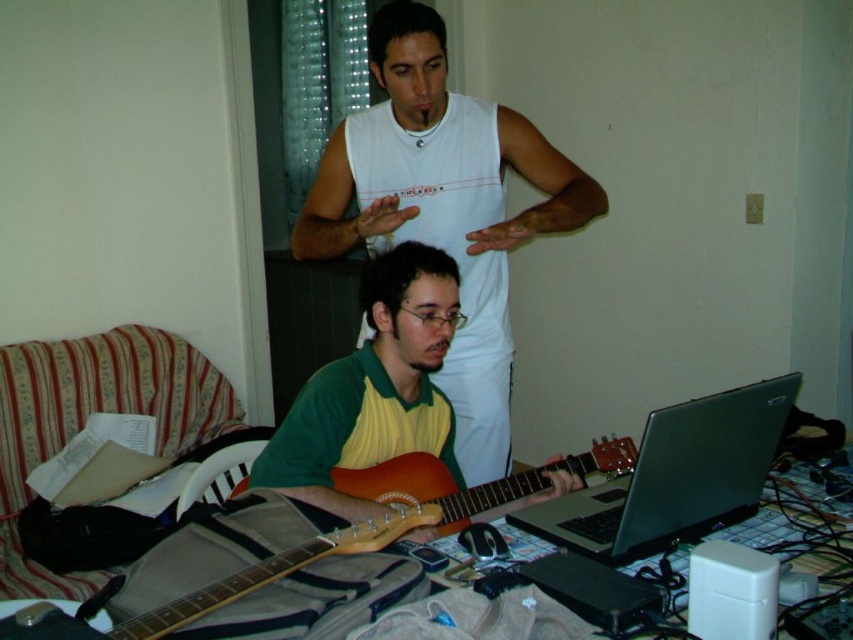
Does green/yellow jersey at center have a larger size compared to wooden acoustic guitar at center?

Actually, green/yellow jersey at center might be smaller than wooden acoustic guitar at center.

Who is positioned more to the left, green/yellow jersey at center or wooden acoustic guitar at center?

A: wooden acoustic guitar at center is more to the left.

Find the location of a particular element. The image size is (853, 640). green/yellow jersey at center is located at coordinates (374, 388).

The height and width of the screenshot is (640, 853). What are the coordinates of `green/yellow jersey at center` in the screenshot? It's located at (374, 388).

Is white sleeveless shirt at upper center wider than wooden acoustic guitar at center?

Incorrect, white sleeveless shirt at upper center's width does not surpass wooden acoustic guitar at center's.

The height and width of the screenshot is (640, 853). What do you see at coordinates (444, 208) in the screenshot?
I see `white sleeveless shirt at upper center` at bounding box center [444, 208].

You are a GUI agent. You are given a task and a screenshot of the screen. Output one action in this format:
    pyautogui.click(x=<x>, y=<y>)
    Task: Click on the white sleeveless shirt at upper center
    The image size is (853, 640).
    Given the screenshot: What is the action you would take?
    pyautogui.click(x=444, y=208)

Consider the image. Is white sleeveless shirt at upper center thinner than green/yellow jersey at center?

In fact, white sleeveless shirt at upper center might be wider than green/yellow jersey at center.

Does white sleeveless shirt at upper center have a lesser height compared to green/yellow jersey at center?

Incorrect, white sleeveless shirt at upper center's height does not fall short of green/yellow jersey at center's.

Locate an element on the screen. The image size is (853, 640). white sleeveless shirt at upper center is located at coordinates (444, 208).

Locate an element on the screen. This screenshot has height=640, width=853. white sleeveless shirt at upper center is located at coordinates (444, 208).